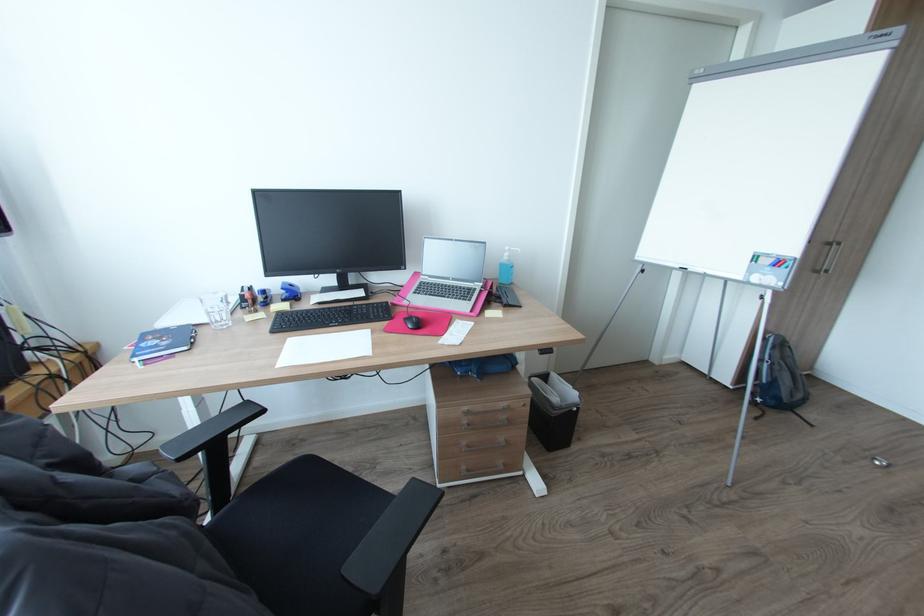
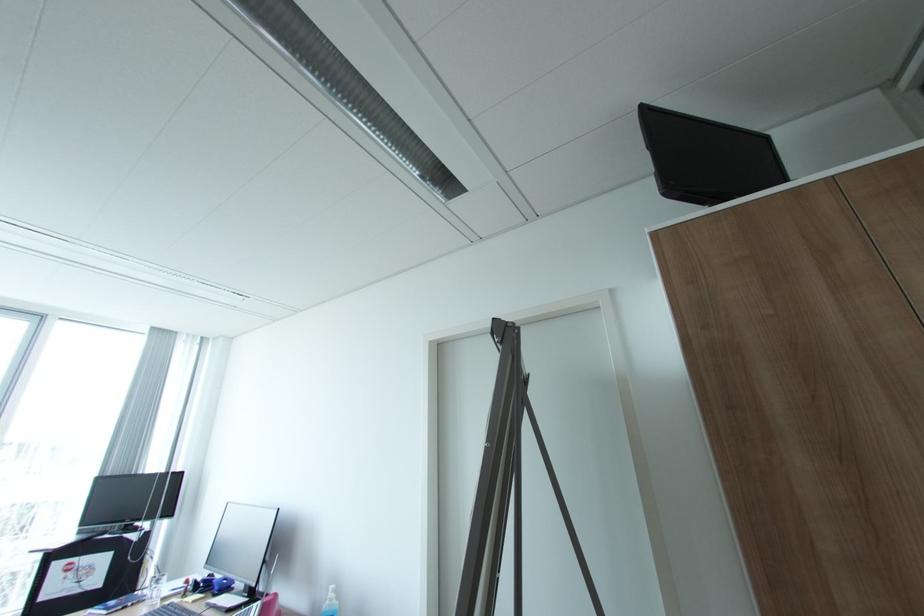
In the second image, find the point that corresponds to (514,256) in the first image.

(336, 599)